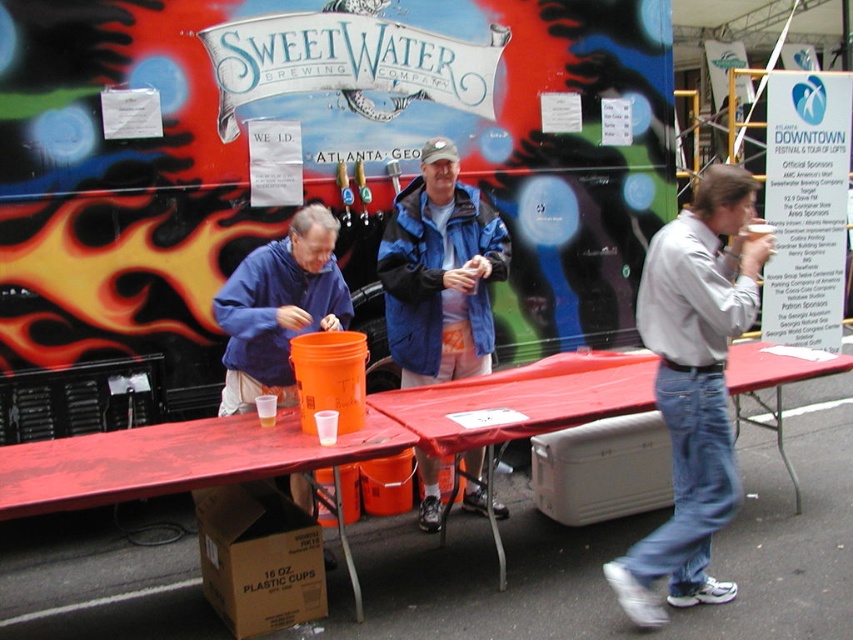
You are a guest at the SweetWater Brewing event and need to place your blue fleece jacket at center on top of the red plastic table at center. Is this possible based on their sizes?

The blue fleece jacket at center is taller than the red plastic table at center, so placing the jacket on top may not be feasible due to its greater height.